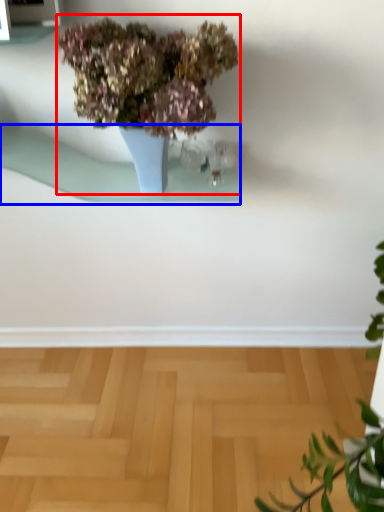
Question: Which point is further to the camera, houseplant (highlighted by a red box) or window sill (highlighted by a blue box)?

Choices:
 (A) houseplant
 (B) window sill

Answer: (B)